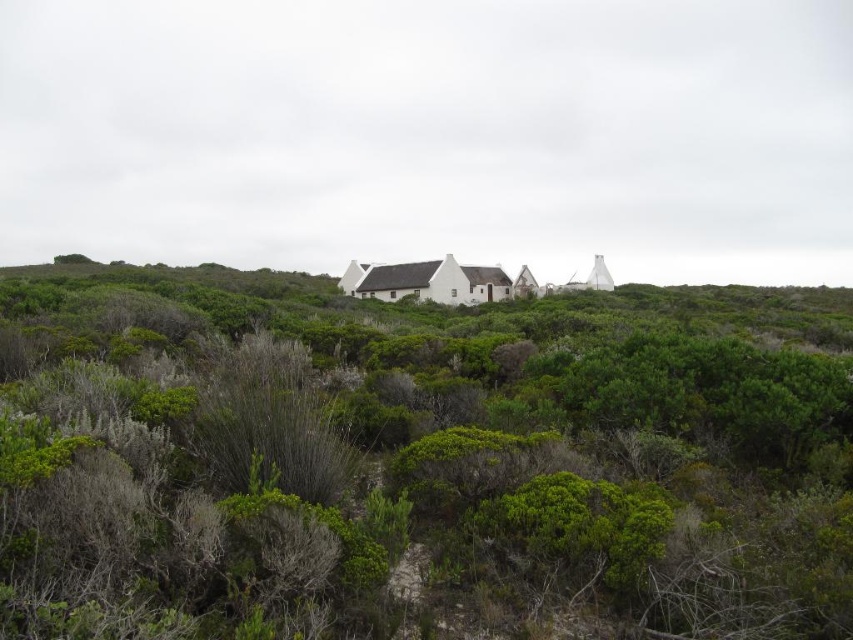
Is green shrubbery at center thinner than white matte cottage at center?

In fact, green shrubbery at center might be wider than white matte cottage at center.

Based on the photo, does green shrubbery at center have a greater width compared to white matte cottage at center?

Correct, the width of green shrubbery at center exceeds that of white matte cottage at center.

The width and height of the screenshot is (853, 640). In order to click on green shrubbery at center in this screenshot , I will do `click(405, 467)`.

Locate an element on the screen. The image size is (853, 640). green shrubbery at center is located at coordinates (405, 467).